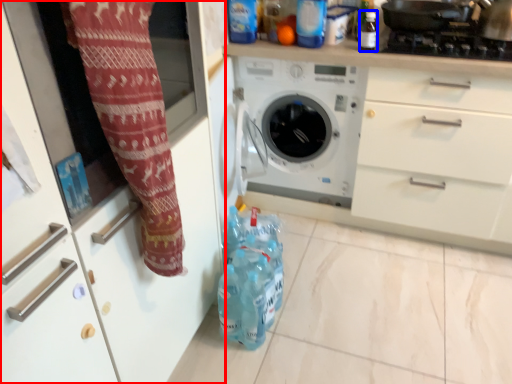
Question: Among these objects, which one is farthest to the camera, cabinetry (highlighted by a red box) or bottle (highlighted by a blue box)?

Choices:
 (A) cabinetry
 (B) bottle

Answer: (B)